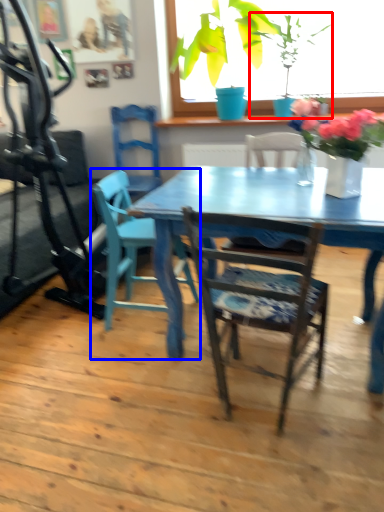
Question: Among these objects, which one is nearest to the camera, houseplant (highlighted by a red box) or chair (highlighted by a blue box)?

Choices:
 (A) houseplant
 (B) chair

Answer: (B)